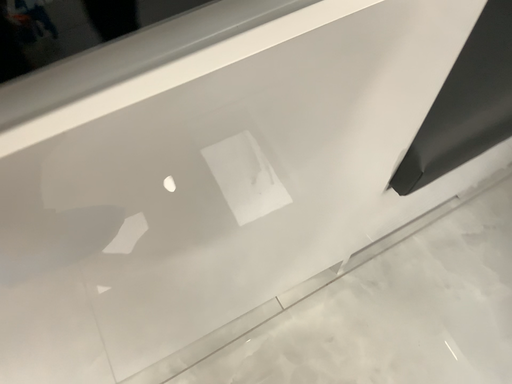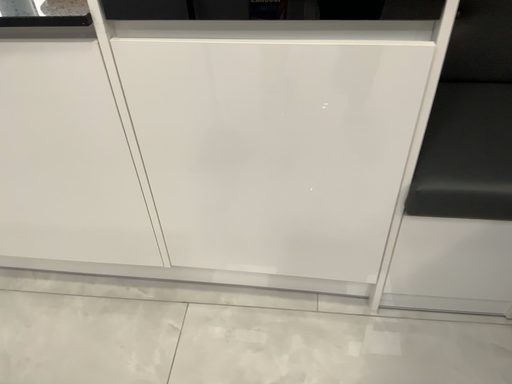
Question: How did the camera likely rotate when shooting the video?

Choices:
 (A) rotated left
 (B) rotated right

Answer: (A)